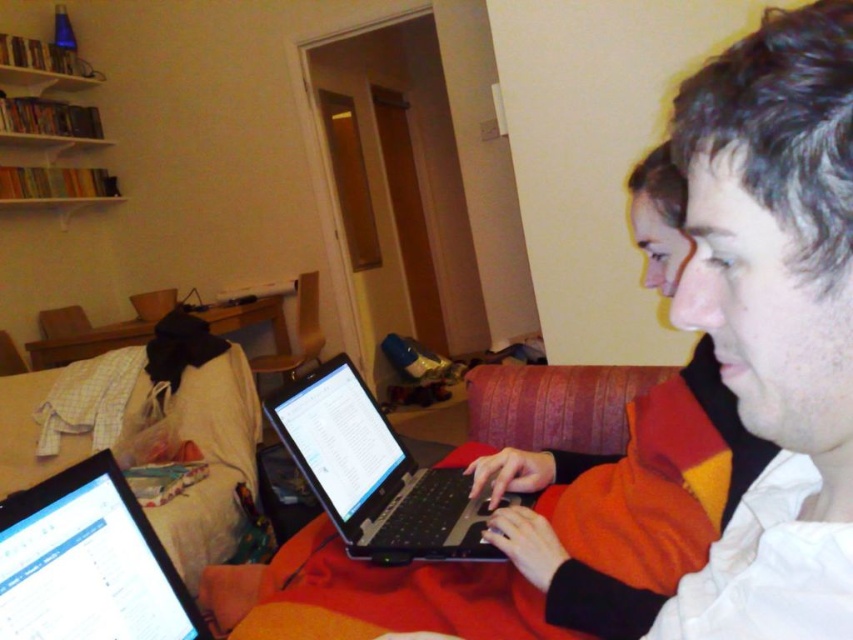
You are a delivery robot carrying a package that needs to be placed on the black plastic laptop at center. The robot has a delivery arm that can reach up to 35 inches. Can the robot place the package on the laptop without moving closer?

The black plastic laptop at center is 37.46 inches away from the camera. Since the robot can only reach up to 35 inches, it cannot place the package on the laptop without moving closer.

You are trying to decide which laptop to use based on their sizes. The scene shows a matte black laptop at center and a black glossy laptop at lower left. Which one is taller?

The matte black laptop at center is much taller than the black glossy laptop at lower left.